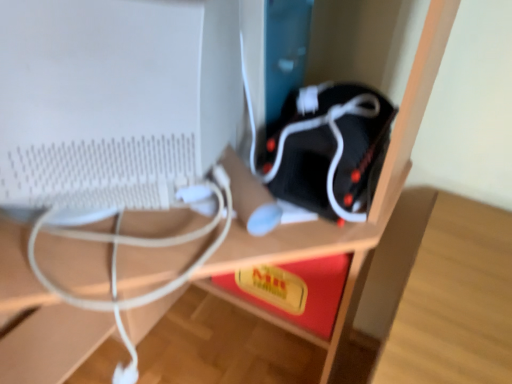
Question: From a real-world perspective, is black matte speaker at center positioned over white matte computer monitor at left based on gravity?

Choices:
 (A) yes
 (B) no

Answer: (B)

Question: Can you see black matte speaker at center touching white matte computer monitor at left?

Choices:
 (A) yes
 (B) no

Answer: (B)

Question: Is black matte speaker at center aimed at white matte computer monitor at left?

Choices:
 (A) yes
 (B) no

Answer: (B)

Question: From the image's perspective, is black matte speaker at center located above white matte computer monitor at left?

Choices:
 (A) yes
 (B) no

Answer: (B)

Question: Is black matte speaker at center to the right of white matte computer monitor at left from the viewer's perspective?

Choices:
 (A) no
 (B) yes

Answer: (B)

Question: Is black matte speaker at center shorter than white matte computer monitor at left?

Choices:
 (A) no
 (B) yes

Answer: (B)

Question: Considering the relative sizes of white matte computer monitor at left and black matte speaker at center in the image provided, is white matte computer monitor at left wider than black matte speaker at center?

Choices:
 (A) no
 (B) yes

Answer: (B)

Question: Does white matte computer monitor at left have a lesser height compared to black matte speaker at center?

Choices:
 (A) yes
 (B) no

Answer: (B)

Question: Is black matte speaker at center at the back of white matte computer monitor at left?

Choices:
 (A) no
 (B) yes

Answer: (B)

Question: Is black matte speaker at center inside white matte computer monitor at left?

Choices:
 (A) no
 (B) yes

Answer: (A)

Question: Is white matte computer monitor at left in front of black matte speaker at center?

Choices:
 (A) yes
 (B) no

Answer: (A)

Question: Can you confirm if white matte computer monitor at left is positioned to the left of black matte speaker at center?

Choices:
 (A) yes
 (B) no

Answer: (A)

Question: Looking at their shapes, would you say white matte computer monitor at left is wider or thinner than black matte speaker at center?

Choices:
 (A) wide
 (B) thin

Answer: (A)